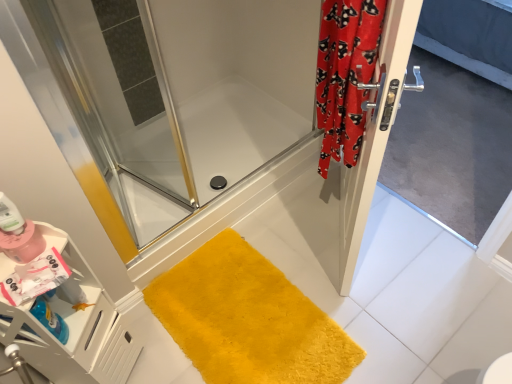
Question: From a real-world perspective, is silver metallic screen door at right above or below satin silver door at right?

Choices:
 (A) below
 (B) above

Answer: (A)

Question: Is silver metallic screen door at right wider or thinner than satin silver door at right?

Choices:
 (A) wide
 (B) thin

Answer: (B)

Question: Considering the real-world distances, which object is closest to the matte pink bottle at lower left?

Choices:
 (A) silver metallic screen door at right
 (B) yellow plush bath mat at lower center
 (C) clear glass shower door at center
 (D) red velvet curtain at right
 (E) satin silver door at right

Answer: (B)

Question: Estimate the real-world distances between objects in this image. Which object is closer to the yellow plush bath mat at lower center?

Choices:
 (A) clear glass shower door at center
 (B) satin silver door at right
 (C) red velvet curtain at right
 (D) silver metallic screen door at right
 (E) matte pink bottle at lower left

Answer: (B)